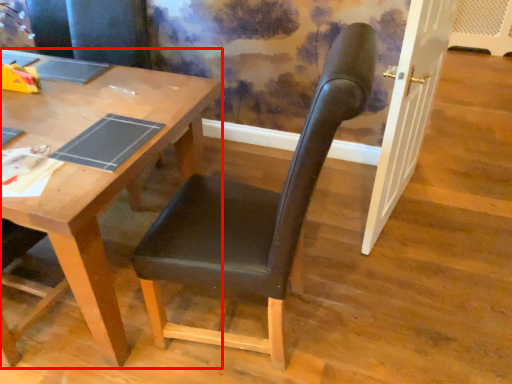
Question: From the image's perspective, where is desk (annotated by the red box) located in relation to chair in the image?

Choices:
 (A) above
 (B) below

Answer: (A)